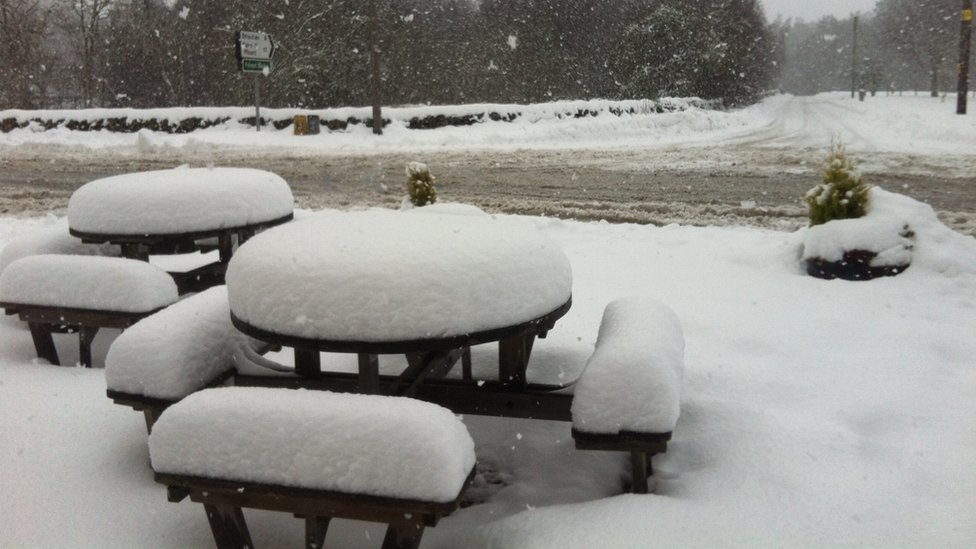
Find the location of a particular element. Image resolution: width=976 pixels, height=549 pixels. box is located at coordinates (307, 122).